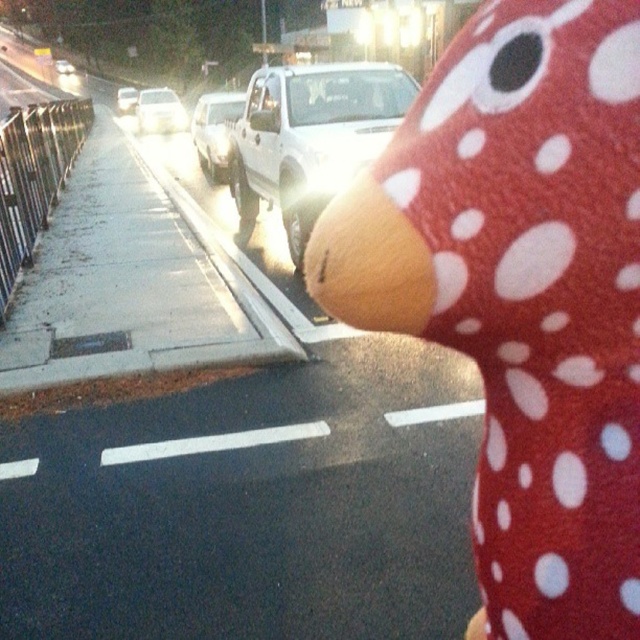
Question: Can you confirm if white matte truck at center is positioned above white glossy car at upper left?

Choices:
 (A) no
 (B) yes

Answer: (A)

Question: Considering the relative positions of white matte truck at center and white glossy car at upper left in the image provided, where is white matte truck at center located with respect to white glossy car at upper left?

Choices:
 (A) right
 (B) left

Answer: (A)

Question: Which of the following is the closest to the observer?

Choices:
 (A) (58, 67)
 (B) (518, 221)
 (C) (144, 92)

Answer: (B)

Question: Which of the following is the farthest from the observer?

Choices:
 (A) (170, 118)
 (B) (125, 100)
 (C) (596, 429)

Answer: (B)

Question: Which object appears farthest from the camera in this image?

Choices:
 (A) concrete at center
 (B) shiny silver suv at center
 (C) white matte truck at center
 (D) white glossy car at upper left

Answer: (D)

Question: Can you confirm if red polka dot plush at right is positioned to the left of white matte truck at center?

Choices:
 (A) no
 (B) yes

Answer: (A)